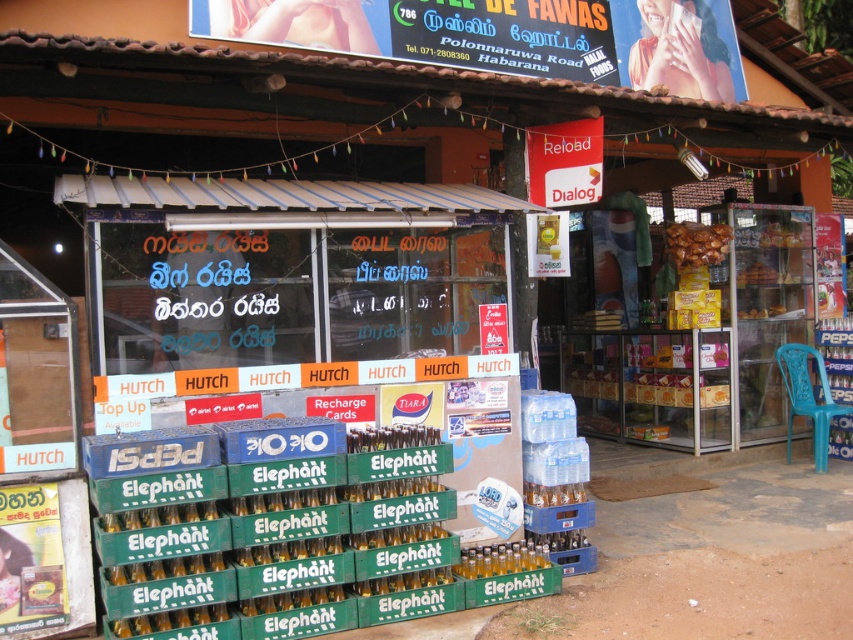
You are a customer standing outside the convenience store on Polonnaruwa Road. You notice the black plastic signboard at upper center and the brown crispy snack at right. Which object is wider?

The black plastic signboard at upper center is wider than the brown crispy snack at right.

You are standing outside the convenience store on Polonnaruwa Road. You notice two points marked on the store facade. The first point is at coordinates point (614, 54) and the second is at point (683, 244). From your perspective outside, which point is closer to you?

Point (614, 54) is in front of point (683, 244), so the first point is closer to you.